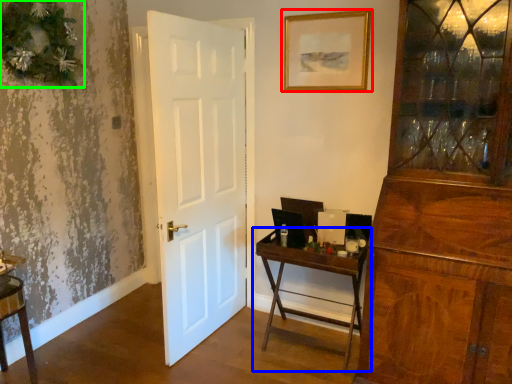
Question: Based on their relative distances, which object is farther from picture frame (highlighted by a red box)? Choose from table (highlighted by a blue box) and christmas decoration (highlighted by a green box).

Choices:
 (A) table
 (B) christmas decoration

Answer: (B)